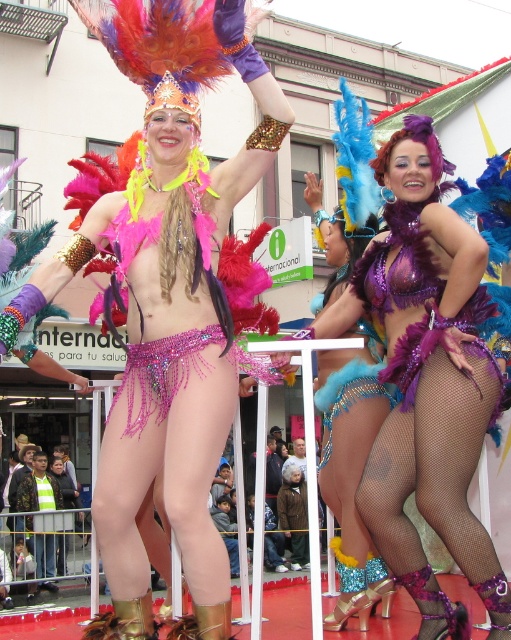
You are a photographer taking a picture of the performers in the parade. You want to ensure the shiny purple bikini at center is perfectly centered in your shot. What coordinates should you aim for?

The shiny purple bikini at center is located at coordinates [429,385], so you should aim for those coordinates to center it in your shot.

You are a photographer at the parade and want to capture the shiny sequined bikini at center in your shot. What coordinates should you aim your camera at to ensure it is centered?

To center the shiny sequined bikini at center, aim your camera at the coordinates point (168, 292).

You are a photographer standing 5 meters away from the shiny sequined bikini at center and the shiny blue fabric at center. You want to take a photo that includes both objects in the frame. Can you capture both in a single shot without moving your position? Explain your reasoning.

The shiny sequined bikini at center and shiny blue fabric at center are 6.24 meters apart. Since you are standing 5 meters away from both objects, the distance between them is greater than your distance from them. This means the angle required to capture both in a single frame may exceed the camera lens field of view, making it difficult to include both without moving closer or using a wider lens.